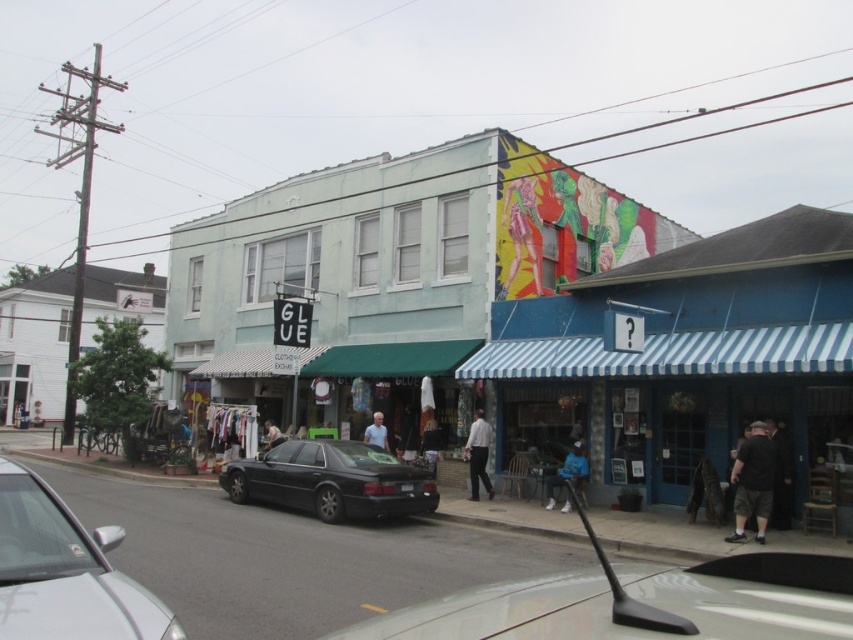
What do you see at coordinates (753, 481) in the screenshot? This screenshot has height=640, width=853. I see `dark gray shorts at lower right` at bounding box center [753, 481].

Does point (738, 512) come closer to viewer compared to point (474, 420)?

Yes, point (738, 512) is closer to viewer.

The image size is (853, 640). Describe the element at coordinates (753, 481) in the screenshot. I see `dark gray shorts at lower right` at that location.

In order to click on dark gray shorts at lower right in this screenshot , I will do `click(753, 481)`.

Is silver metallic car at lower left smaller than blue fabric jacket at lower center?

Yes.

Does silver metallic car at lower left have a lesser height compared to blue fabric jacket at lower center?

Indeed, silver metallic car at lower left has a lesser height compared to blue fabric jacket at lower center.

Locate an element on the screen. The image size is (853, 640). silver metallic car at lower left is located at coordinates (65, 572).

Which is behind, point (88, 573) or point (302, 476)?

Point (302, 476)

Is point (155, 634) positioned behind point (334, 461)?

No, it is not.

Locate an element on the screen. silver metallic car at lower left is located at coordinates (65, 572).